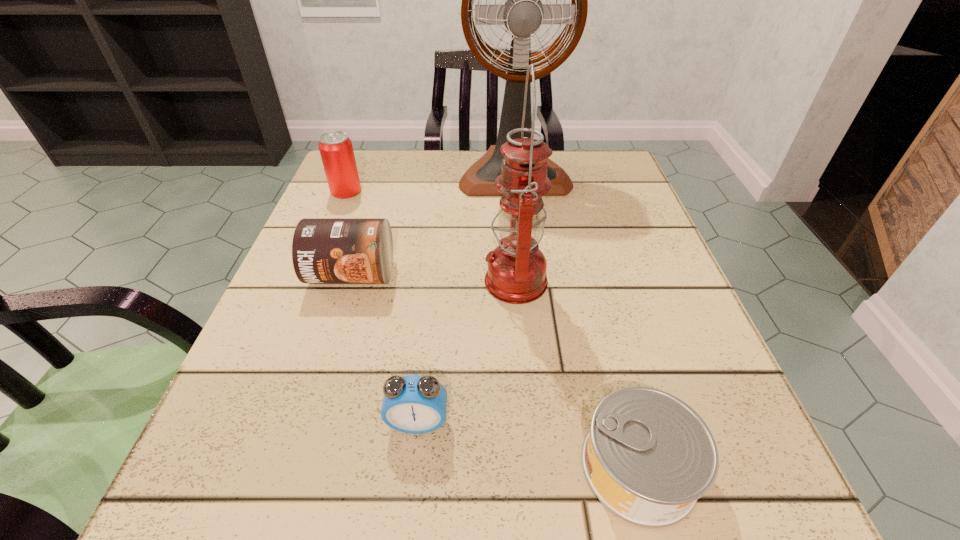
Locate an element on the screen. This screenshot has height=540, width=960. vacant area located 0.140m on the back of the oil lamp is located at coordinates (510, 209).

Find the location of a particular element. Image resolution: width=960 pixels, height=540 pixels. vacant region located 0.200m on the right of the farthest can is located at coordinates (451, 191).

The width and height of the screenshot is (960, 540). What are the coordinates of `vacant space situated on the front label of the second tallest can` in the screenshot? It's located at (318, 383).

Locate an element on the screen. The width and height of the screenshot is (960, 540). vacant area situated 0.060m on the face of the alarm clock is located at coordinates (411, 483).

This screenshot has width=960, height=540. In order to click on vacant space situated on the back of the shortest object in this screenshot , I will do `click(581, 248)`.

The image size is (960, 540). I want to click on fan that is at the far edge, so pos(523,13).

Where is `can at the far edge`? This screenshot has height=540, width=960. can at the far edge is located at coordinates (336, 150).

You are a GUI agent. You are given a task and a screenshot of the screen. Output one action in this format:
    pyautogui.click(x=<x>, y=<y>)
    Task: Click on the object that is at the near edge
    This screenshot has width=960, height=540.
    Given the screenshot: What is the action you would take?
    pyautogui.click(x=648, y=457)

The width and height of the screenshot is (960, 540). What are the coordinates of `fan present at the right edge` in the screenshot? It's located at (523, 13).

Where is `can that is positioned at the right edge`? The width and height of the screenshot is (960, 540). can that is positioned at the right edge is located at coordinates (648, 457).